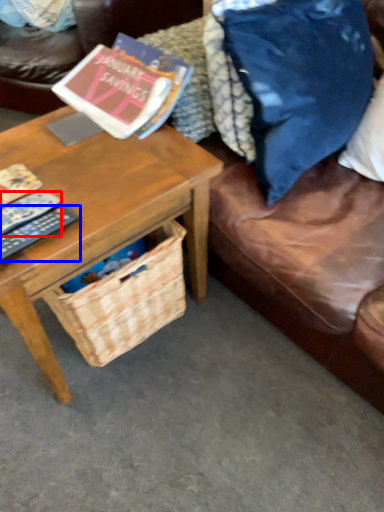
Question: Which object appears farthest to the camera in this image, remote control (highlighted by a red box) or remote control (highlighted by a blue box)?

Choices:
 (A) remote control
 (B) remote control

Answer: (A)